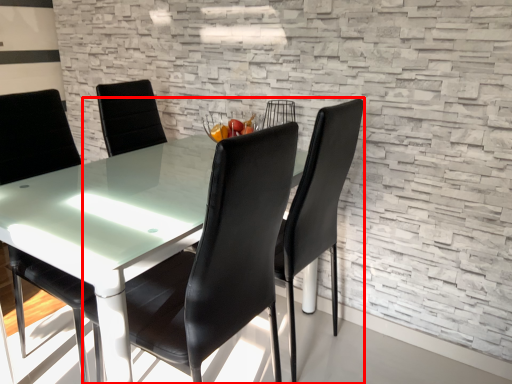
Question: From the image's perspective, considering the relative positions of chair (annotated by the red box) and chair in the image provided, where is chair (annotated by the red box) located with respect to the staircase?

Choices:
 (A) below
 (B) above

Answer: (A)